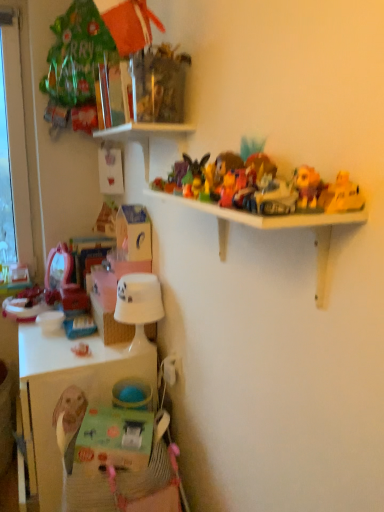
This screenshot has width=384, height=512. What are the coordinates of `free space to the left of matte pink toy at lower left, which is counted as the first toy, starting from the left` in the screenshot? It's located at (45, 352).